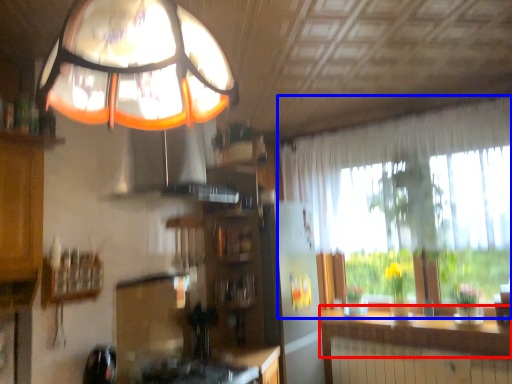
Question: Which object is further to the camera taking this photo, counter top (highlighted by a red box) or window (highlighted by a blue box)?

Choices:
 (A) counter top
 (B) window

Answer: (A)